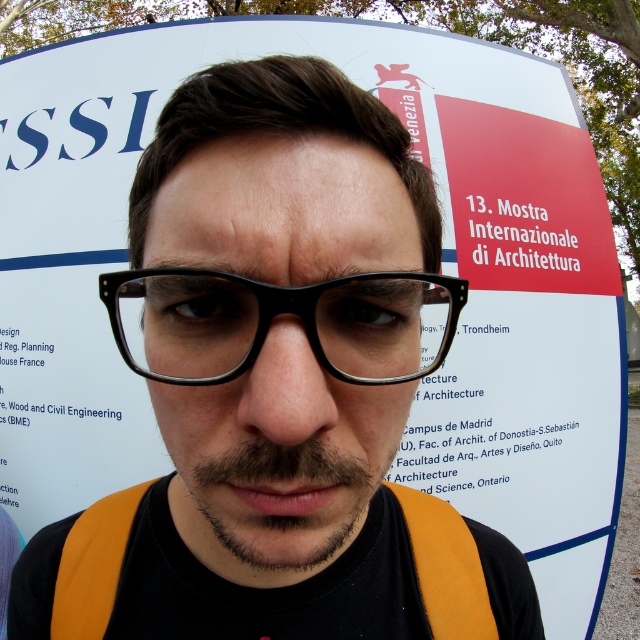
Is black plastic glasses at center closer to camera compared to dark brown stubble at center?

No, black plastic glasses at center is behind dark brown stubble at center.

Between black plastic glasses at center and dark brown stubble at center, which one has less height?

Standing shorter between the two is black plastic glasses at center.

Is point (156, 285) positioned after point (365, 504)?

No, it is in front of (365, 504).

Where is `black plastic glasses at center`? Image resolution: width=640 pixels, height=640 pixels. black plastic glasses at center is located at coordinates (276, 314).